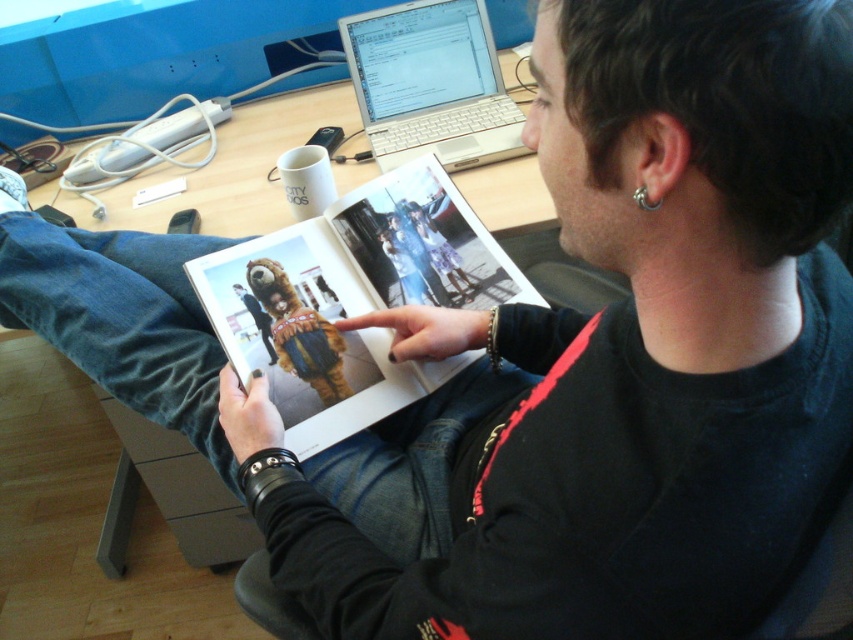
You are a photographer trying to capture a closeup of the silver metallic ring at ear and the matte paper magazine at center. Which object should you focus on first to ensure both are in focus?

The silver metallic ring at ear is behind the matte paper magazine at center, so you should focus on the matte paper magazine at center first to ensure both are in focus.

You are organizing a desk and need to move the matte paper magazine at center and the silver metallic laptop at upper center. Based on their current positions, which object is located lower on the desk?

The matte paper magazine at center is positioned under the silver metallic laptop at upper center, so it is located lower on the desk.

You are organizing a desk and want to place the matte paper magazine at center and the silver metallic laptop at upper center. Given their sizes, which object will require more horizontal space on the desk?

The matte paper magazine at center requires more horizontal space on the desk because its width surpasses that of the silver metallic laptop at upper center.